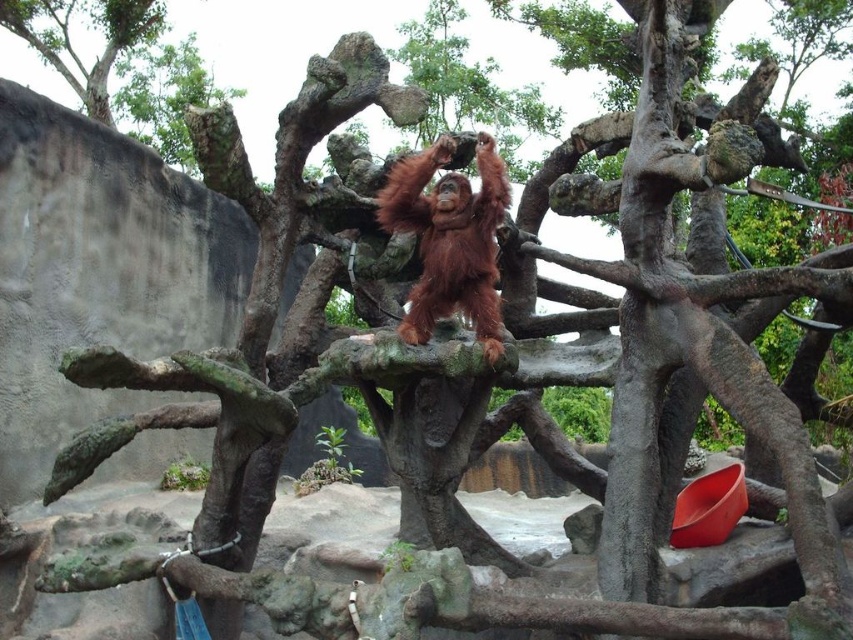
Question: Does orange fur orangutan at center have a larger size compared to rough bark tree at upper left?

Choices:
 (A) yes
 (B) no

Answer: (B)

Question: Estimate the real-world distances between objects in this image. Which object is farther from the smooth gray tree trunk at right?

Choices:
 (A) orange fur orangutan at center
 (B) rough bark tree at upper left

Answer: (B)

Question: Is smooth gray tree trunk at right bigger than orange fur orangutan at center?

Choices:
 (A) no
 (B) yes

Answer: (B)

Question: Which object is the farthest from the rough bark tree at upper left?

Choices:
 (A) smooth gray tree trunk at right
 (B) orange fur orangutan at center

Answer: (A)

Question: Based on their relative distances, which object is farther from the smooth gray tree trunk at right?

Choices:
 (A) orange fur orangutan at center
 (B) rough bark tree at upper left

Answer: (B)

Question: Does smooth gray tree trunk at right have a lesser width compared to orange fur orangutan at center?

Choices:
 (A) no
 (B) yes

Answer: (A)